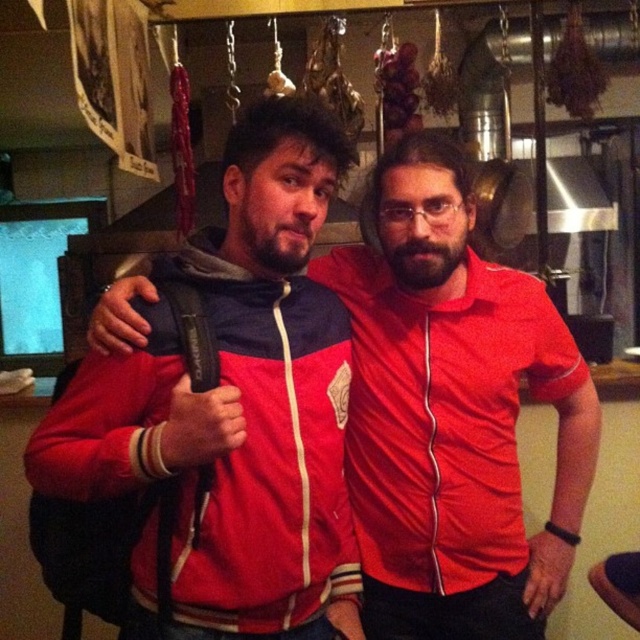
Question: Can you confirm if red matte jacket at center is bigger than matte red shirt at center?

Choices:
 (A) yes
 (B) no

Answer: (A)

Question: Among these objects, which one is farthest from the camera?

Choices:
 (A) red/white zip-up jacket at center
 (B) red matte jacket at center
 (C) matte red shirt at center

Answer: (C)

Question: Does red matte jacket at center lie behind red/white zip-up jacket at center?

Choices:
 (A) yes
 (B) no

Answer: (A)

Question: Among these objects, which one is nearest to the camera?

Choices:
 (A) matte red shirt at center
 (B) red matte jacket at center

Answer: (B)

Question: Based on their relative distances, which object is nearer to the matte red shirt at center?

Choices:
 (A) red/white zip-up jacket at center
 (B) red matte jacket at center

Answer: (B)

Question: Does red matte jacket at center have a smaller size compared to red/white zip-up jacket at center?

Choices:
 (A) yes
 (B) no

Answer: (B)